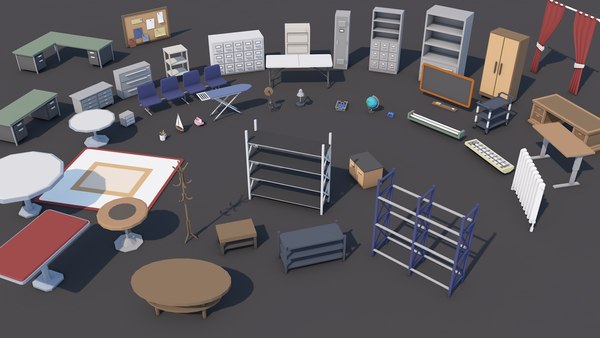
Where is `wall hangings`? wall hangings is located at coordinates (461, 92), (142, 28), (583, 26), (444, 129), (480, 149).